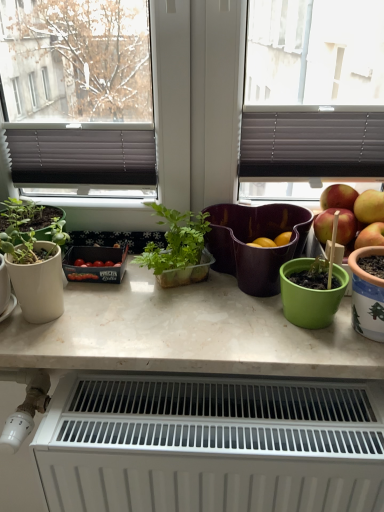
At what (x,y) coordinates should I click in order to perform the action: click on free space to the left of white ceramic pot at right, acting as the 1th flowerpot starting from the front. Please return your answer as a coordinate pair (x, y). This screenshot has height=512, width=384. Looking at the image, I should click on (279, 340).